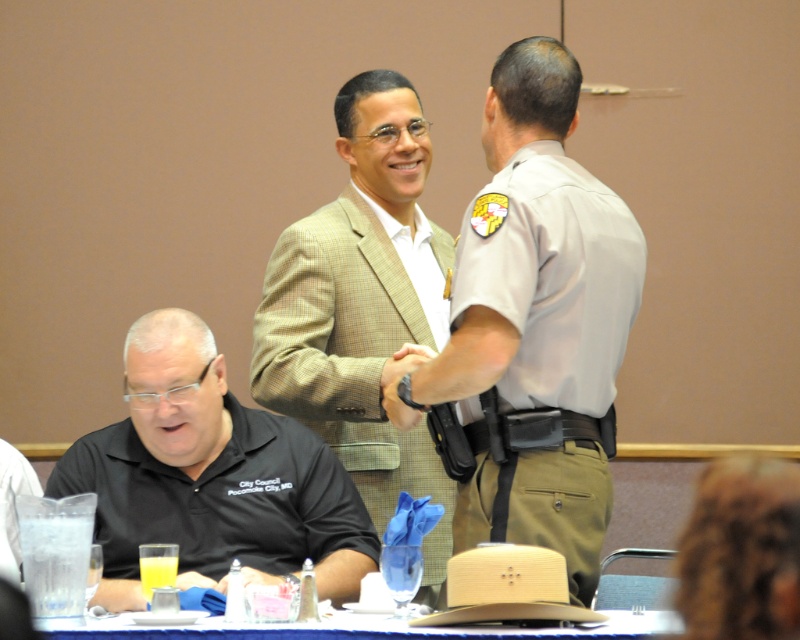
You are standing in the room and want to place a new item exactly where the light brown textured blazer at center is currently located. Is this position available for placement?

The light brown textured blazer at center is located at point (362, 307), so the position is occupied by the blazer and cannot be used for placement.

You are a photographer setting up for a group photo. You need to ensure that the black matte shirt at lower left and the blue fabric table at lower center are both in frame. Given their sizes, which object would require more space horizontally to fully capture in the photo?

The blue fabric table at lower center requires more horizontal space because its width is greater than the black matte shirt at lower left.

You are a photographer setting up for a formal event. You need to position a spotlight so it illuminates both the khaki textured suit at upper center and the black matte shirt at lower left equally. Considering their heights, which object should you adjust the spotlight height closer to?

The khaki textured suit at upper center is much taller than the black matte shirt at lower left. To illuminate both equally, the spotlight should be adjusted closer to the height of the black matte shirt at lower left so the light can reach both effectively.